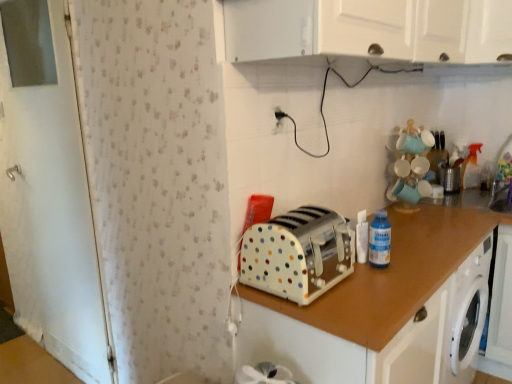
Question: Can you confirm if metallic silver toaster at upper right is wider than white plastic electric outlet at upper center?

Choices:
 (A) no
 (B) yes

Answer: (B)

Question: From a real-world perspective, is metallic silver toaster at upper right beneath white plastic electric outlet at upper center?

Choices:
 (A) no
 (B) yes

Answer: (B)

Question: From the image's perspective, does metallic silver toaster at upper right appear higher than white plastic electric outlet at upper center?

Choices:
 (A) yes
 (B) no

Answer: (B)

Question: Can you confirm if metallic silver toaster at upper right is thinner than white plastic electric outlet at upper center?

Choices:
 (A) no
 (B) yes

Answer: (A)

Question: Does metallic silver toaster at upper right have a larger size compared to white plastic electric outlet at upper center?

Choices:
 (A) yes
 (B) no

Answer: (A)

Question: Do you think transparent plastic sink at lower right is within blue plastic bottle at upper right, or outside of it?

Choices:
 (A) inside
 (B) outside

Answer: (B)

Question: Is transparent plastic sink at lower right in front of or behind blue plastic bottle at upper right in the image?

Choices:
 (A) front
 (B) behind

Answer: (B)

Question: In terms of width, does transparent plastic sink at lower right look wider or thinner when compared to blue plastic bottle at upper right?

Choices:
 (A) wide
 (B) thin

Answer: (A)

Question: From a real-world perspective, is transparent plastic sink at lower right above or below blue plastic bottle at upper right?

Choices:
 (A) above
 (B) below

Answer: (B)

Question: Looking at the image, does blue plastic bottle at upper right seem bigger or smaller compared to white glossy cabinet at upper center, which ranks as the first cabinetry in top-to-bottom order?

Choices:
 (A) small
 (B) big

Answer: (A)

Question: Is blue plastic bottle at upper right to the left or to the right of white glossy cabinet at upper center, marked as the 2th cabinetry in a bottom-to-top arrangement, in the image?

Choices:
 (A) right
 (B) left

Answer: (B)

Question: Is blue plastic bottle at upper right taller or shorter than white glossy cabinet at upper center, which ranks as the first cabinetry in top-to-bottom order?

Choices:
 (A) short
 (B) tall

Answer: (A)

Question: Would you say blue plastic bottle at upper right is inside or outside white glossy cabinet at upper center, marked as the 2th cabinetry in a bottom-to-top arrangement?

Choices:
 (A) outside
 (B) inside

Answer: (A)

Question: From a real-world perspective, relative to blue plastic bottle at upper right, is metallic silver toaster at upper right vertically above or below?

Choices:
 (A) above
 (B) below

Answer: (B)

Question: Is metallic silver toaster at upper right situated inside blue plastic bottle at upper right or outside?

Choices:
 (A) outside
 (B) inside

Answer: (A)